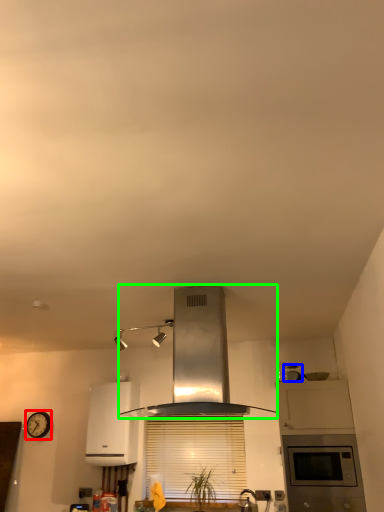
Question: Estimate the real-world distances between objects in this image. Which object is farther from clock (highlighted by a red box), appliance (highlighted by a blue box) or home appliance (highlighted by a green box)?

Choices:
 (A) appliance
 (B) home appliance

Answer: (B)